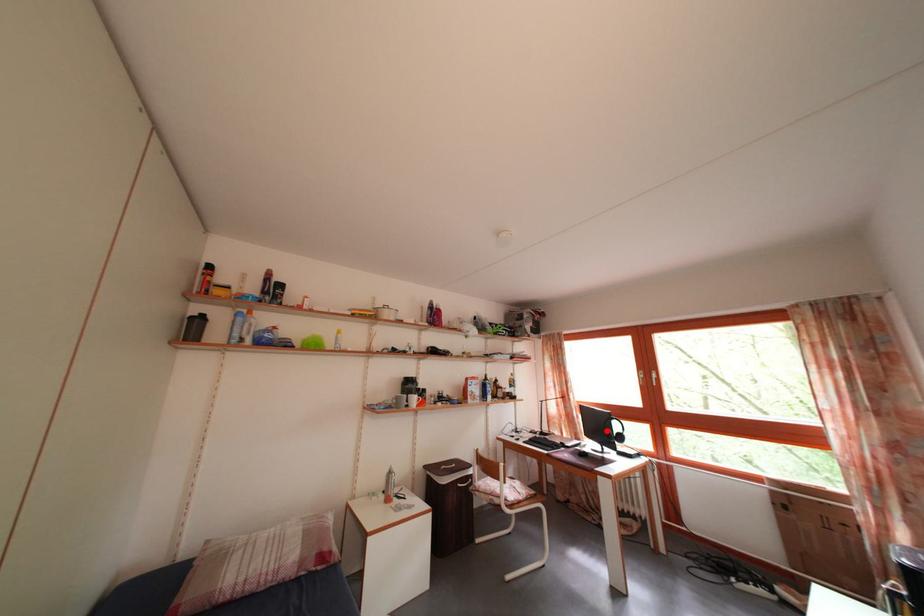
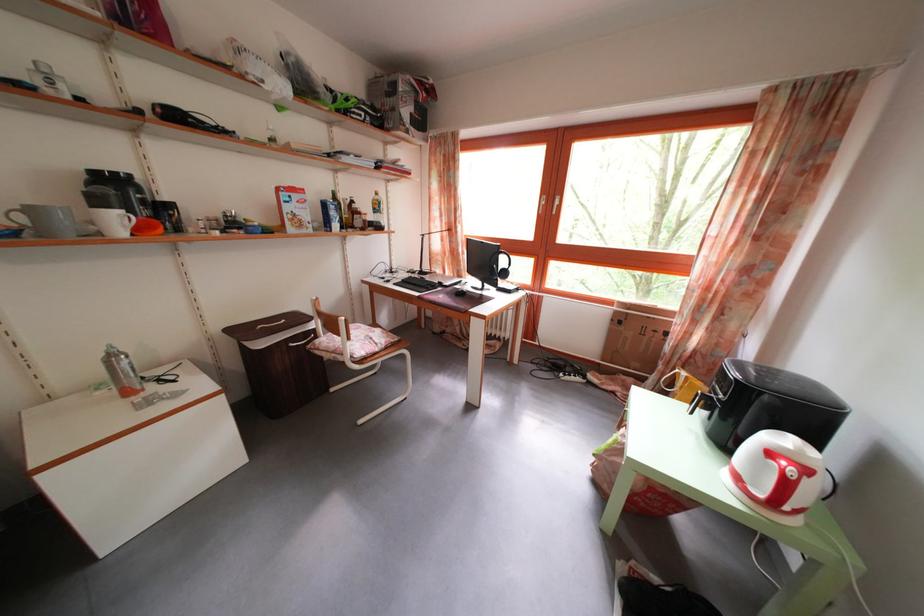
In the second image, find the point that corresponds to the highlighted location in the first image.

(492, 265)